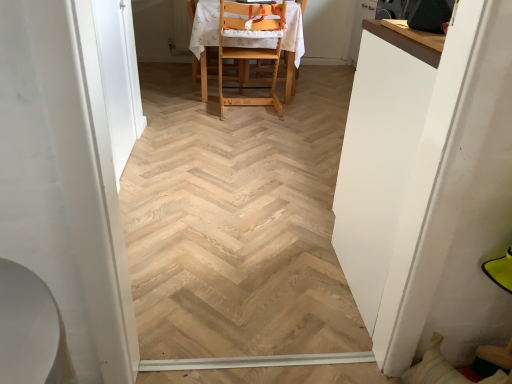
The height and width of the screenshot is (384, 512). Identify the location of free space behind white glossy screen door at left, arranged as the first screen door when viewed from the front. (159, 187).